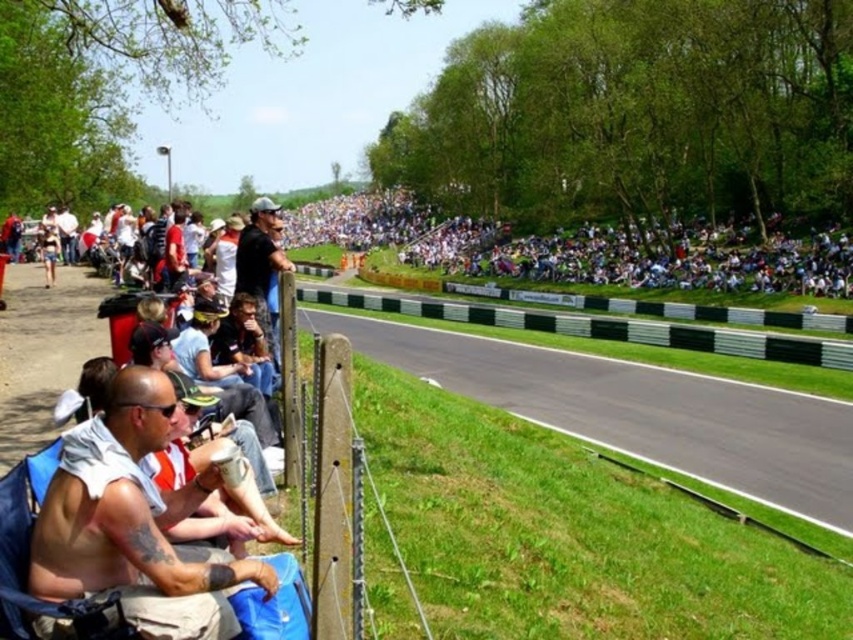
Question: Is black asphalt at center thinner than white cotton shirt at center?

Choices:
 (A) no
 (B) yes

Answer: (B)

Question: Can you confirm if black asphalt at center is bigger than white cotton shirt at center?

Choices:
 (A) yes
 (B) no

Answer: (B)

Question: Which object is positioned farthest from the white cotton shirt at lower left?

Choices:
 (A) white cotton shirt at center
 (B) green plastic barrier at center

Answer: (A)

Question: Does white cotton shirt at center appear over green plastic barrier at center?

Choices:
 (A) no
 (B) yes

Answer: (B)

Question: Which of the following is the closest to the observer?

Choices:
 (A) white cotton shirt at lower left
 (B) green plastic barrier at center
 (C) black asphalt at center
 (D) white cotton shirt at center

Answer: (A)

Question: Among these objects, which one is farthest from the camera?

Choices:
 (A) white cotton shirt at center
 (B) green plastic barrier at center
 (C) white cotton shirt at lower left

Answer: (A)